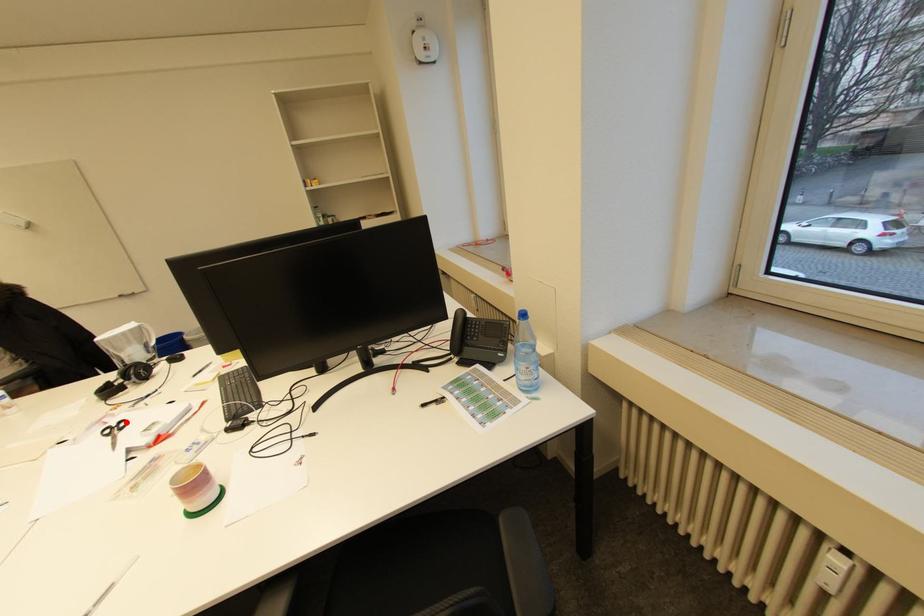
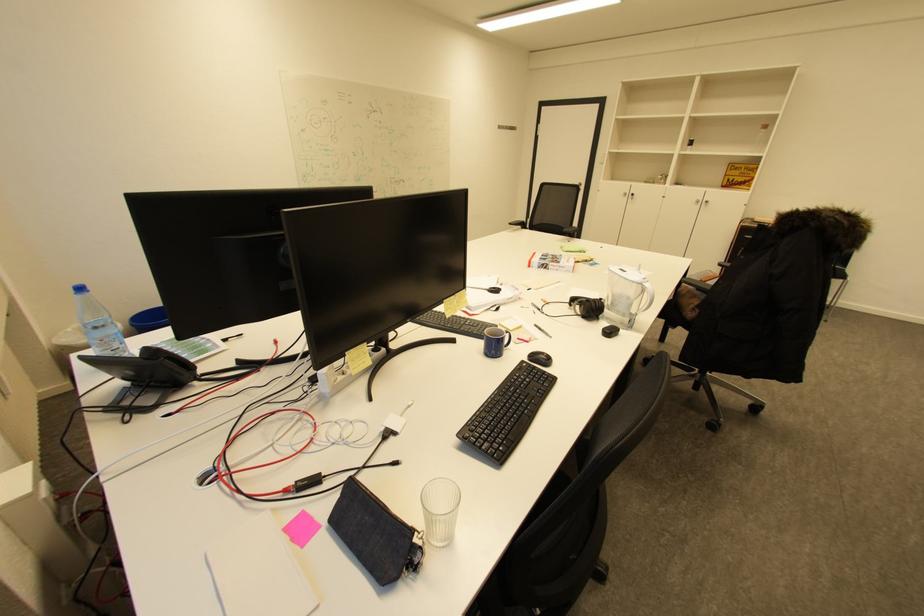
Where in the second image is the point corresponding to the highlighted location from the first image?

(505, 292)